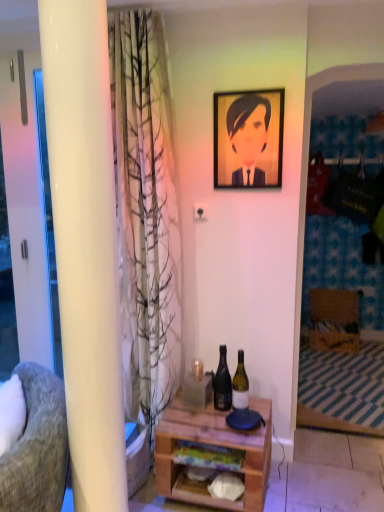
Question: Considering their positions, is white glossy screen door at left located in front of or behind wooden desk at center?

Choices:
 (A) front
 (B) behind

Answer: (B)

Question: Is point (46, 329) positioned closer to the camera than point (208, 502)?

Choices:
 (A) closer
 (B) farther

Answer: (B)

Question: Estimate the real-world distances between objects in this image. Which object is closer to the green glass bottle at center, the 2th bottle when ordered from left to right?

Choices:
 (A) matte yellow portrait at upper center
 (B) textured gray fabric chair at left
 (C) white glossy pillar at left
 (D) matte black bottle at center, the 1th bottle positioned from the left
 (E) white glossy screen door at left

Answer: (D)

Question: Based on their relative distances, which object is nearer to the white glossy pillar at left?

Choices:
 (A) matte yellow portrait at upper center
 (B) matte black bottle at center, marked as the second bottle in a right-to-left arrangement
 (C) green glass bottle at center, the first bottle viewed from the right
 (D) textured gray fabric chair at left
 (E) wooden desk at center

Answer: (D)